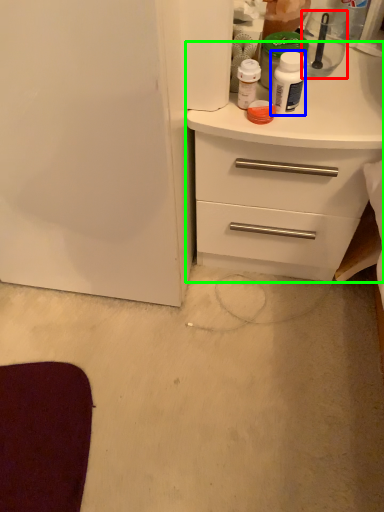
Question: Which object is the closest to the appliance (highlighted by a red box)? Choose among these: bottle (highlighted by a blue box) or chest of drawers (highlighted by a green box).

Choices:
 (A) bottle
 (B) chest of drawers

Answer: (A)